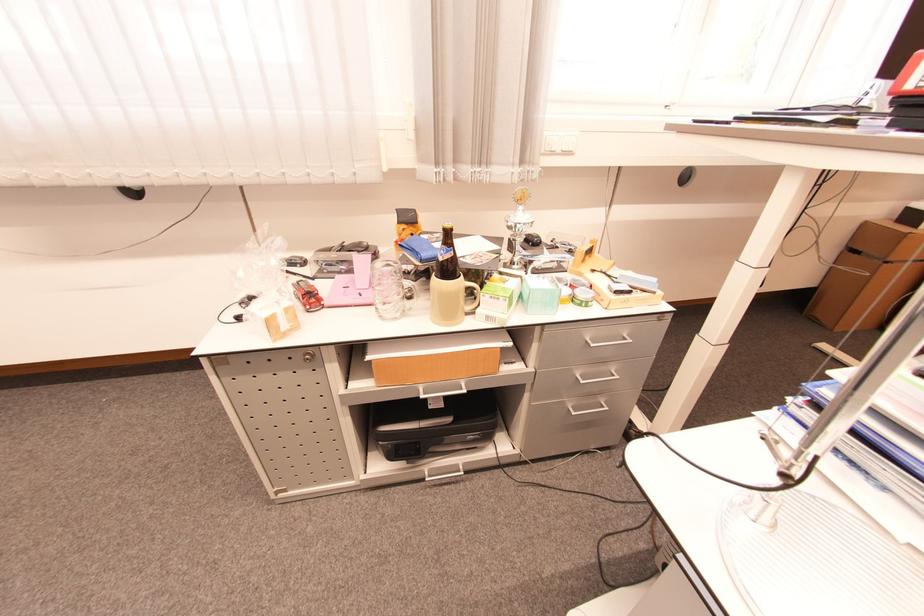
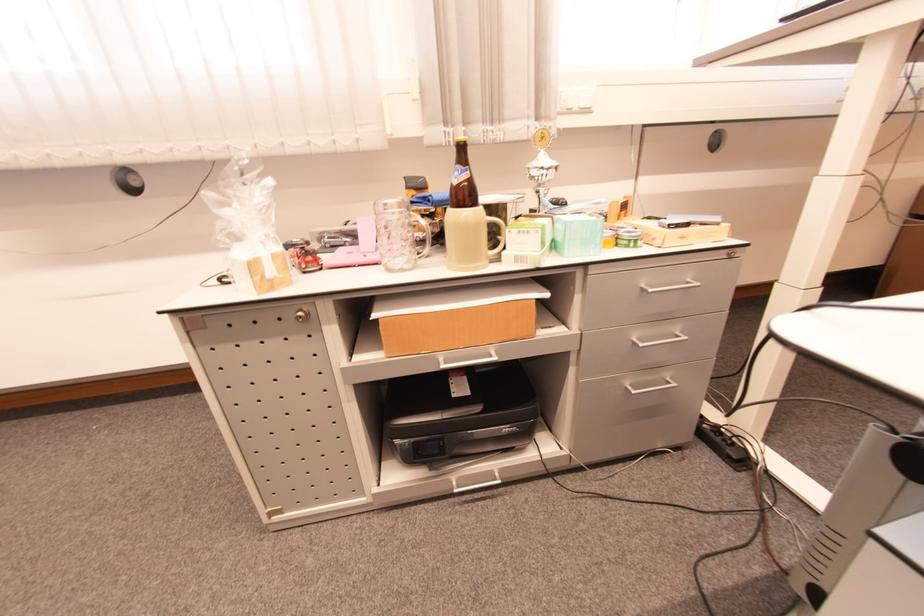
Question: The images are taken continuously from a first-person perspective. In which direction is your viewpoint rotating?

Choices:
 (A) Left
 (B) Right
 (C) Up
 (D) Down

Answer: (C)